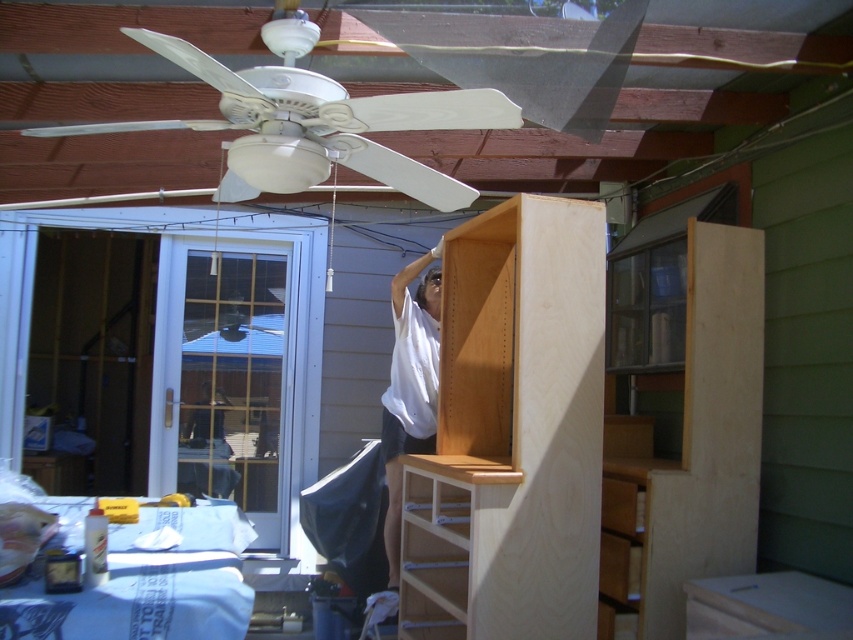
Question: Which object appears farthest from the camera in this image?

Choices:
 (A) white matte ceiling fan at upper center
 (B) white matte shirt at upper center

Answer: (B)

Question: Which point is closer to the camera taking this photo?

Choices:
 (A) (426, 451)
 (B) (315, 124)

Answer: (B)

Question: Is the position of white matte ceiling fan at upper center less distant than that of white matte shirt at upper center?

Choices:
 (A) no
 (B) yes

Answer: (B)

Question: Observing the image, what is the correct spatial positioning of white matte ceiling fan at upper center in reference to white matte shirt at upper center?

Choices:
 (A) below
 (B) above

Answer: (B)

Question: Considering the relative positions of white matte ceiling fan at upper center and white matte shirt at upper center in the image provided, where is white matte ceiling fan at upper center located with respect to white matte shirt at upper center?

Choices:
 (A) below
 (B) above

Answer: (B)